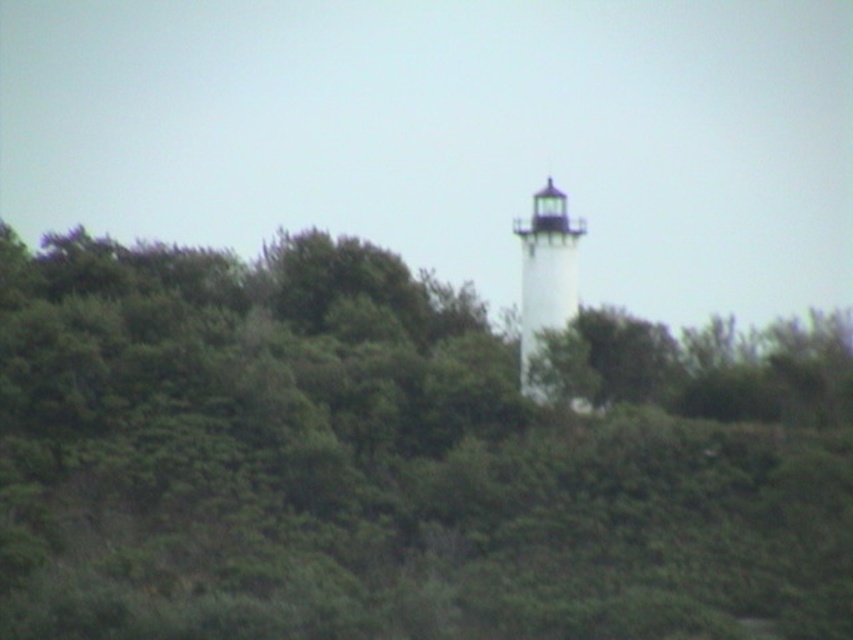
Question: Is green leafy tree at center in front of white painted wood lighthouse at center?

Choices:
 (A) yes
 (B) no

Answer: (A)

Question: Is green leafy tree at center closer to camera compared to white painted wood lighthouse at center?

Choices:
 (A) no
 (B) yes

Answer: (B)

Question: Which of the following is the farthest from the observer?

Choices:
 (A) white painted wood lighthouse at center
 (B) green leafy tree at center

Answer: (A)

Question: Considering the relative positions of green leafy tree at center and white painted wood lighthouse at center in the image provided, where is green leafy tree at center located with respect to white painted wood lighthouse at center?

Choices:
 (A) left
 (B) right

Answer: (A)

Question: Which point appears closest to the camera in this image?

Choices:
 (A) (532, 332)
 (B) (190, 513)

Answer: (B)

Question: Among these points, which one is farthest from the camera?

Choices:
 (A) (158, 401)
 (B) (555, 230)

Answer: (B)